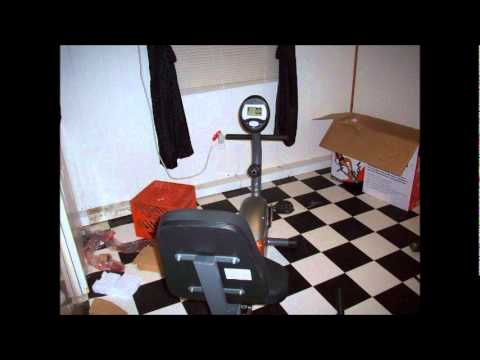
Where is `backrest support frame`? The width and height of the screenshot is (480, 360). backrest support frame is located at coordinates (210, 280).